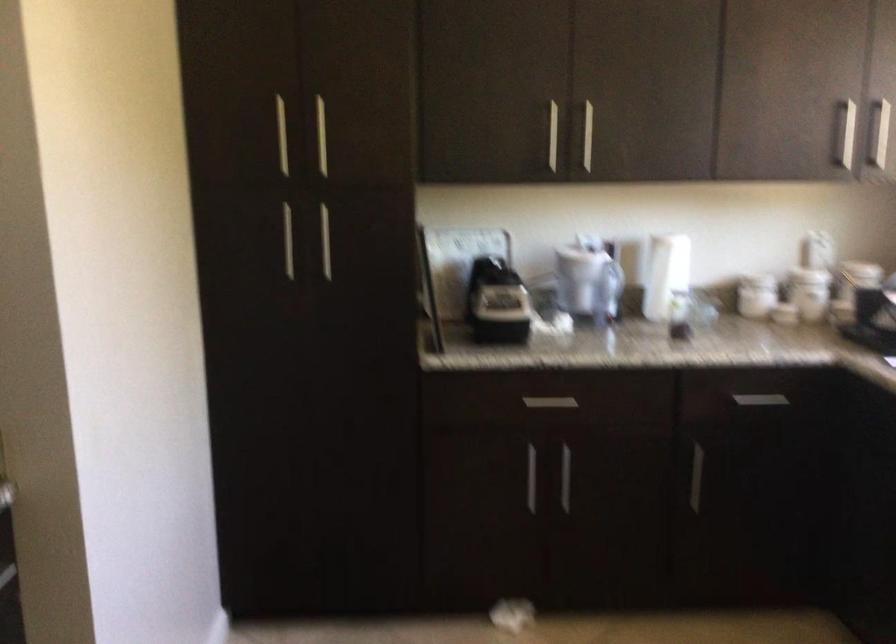
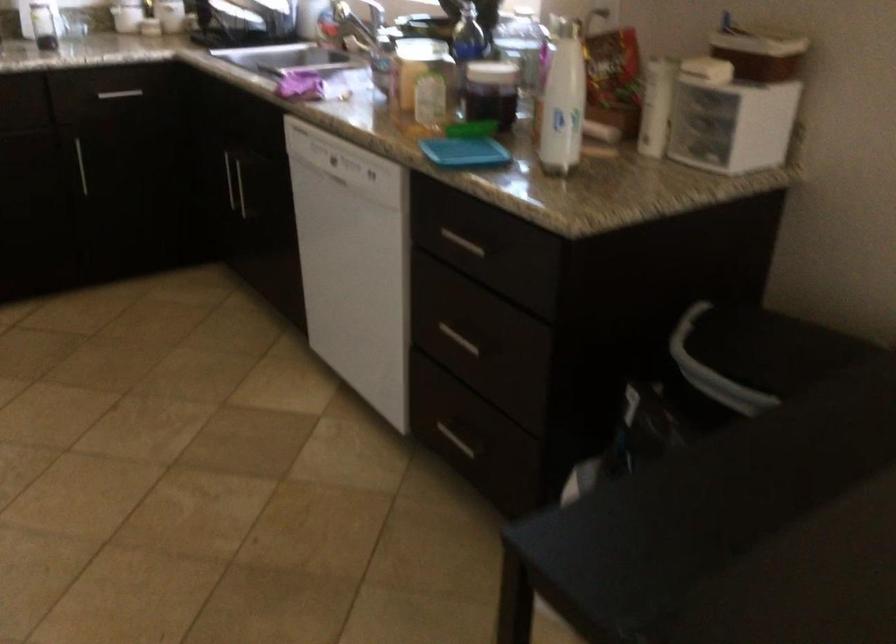
Find the pixel in the second image that matches point (694, 478) in the first image.

(81, 166)